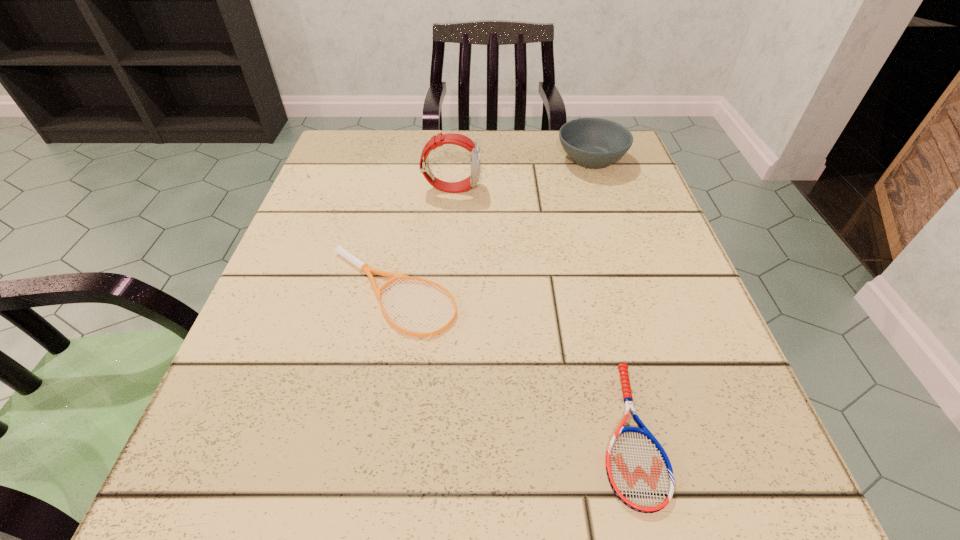
Locate an element on the screen. vacant space that's between the tallest object and the left tennis racket is located at coordinates (423, 241).

In order to click on free space between the tallest object and the nearer tennis racket in this screenshot , I will do click(x=540, y=310).

Where is `free space between the right tennis racket and the third shortest object`? This screenshot has width=960, height=540. free space between the right tennis racket and the third shortest object is located at coordinates (610, 295).

Point out which object is positioned as the second nearest to the left tennis racket. Please provide its 2D coordinates. Your answer should be formatted as a tuple, i.e. [(x, y)], where the tuple contains the x and y coordinates of a point satisfying the conditions above.

[(639, 471)]

Identify the location of object that is the third closest to the nearer tennis racket. (594, 143).

This screenshot has width=960, height=540. What are the coordinates of `vacant area that satisfies the following two spatial constraints: 1. on the face of the tallest object; 2. on the right side of the nearer tennis racket` in the screenshot? It's located at (433, 432).

You are a GUI agent. You are given a task and a screenshot of the screen. Output one action in this format:
    pyautogui.click(x=<x>, y=<y>)
    Task: Click on the vacant point that satisfies the following two spatial constraints: 1. on the face of the watch; 2. on the left side of the shorter tennis racket
    
    Given the screenshot: What is the action you would take?
    pyautogui.click(x=433, y=432)

Locate an element on the screen. vacant space that satisfies the following two spatial constraints: 1. on the front side of the right tennis racket; 2. on the right side of the farther tennis racket is located at coordinates (370, 432).

At what (x,y) coordinates should I click in order to perform the action: click on free spot that satisfies the following two spatial constraints: 1. on the face of the nearer tennis racket; 2. on the left side of the tallest object. Please return your answer as a coordinate pair (x, y). Looking at the image, I should click on click(x=433, y=432).

Find the location of a particular element. blank space that satisfies the following two spatial constraints: 1. on the face of the shorter tennis racket; 2. on the left side of the tallest object is located at coordinates (433, 432).